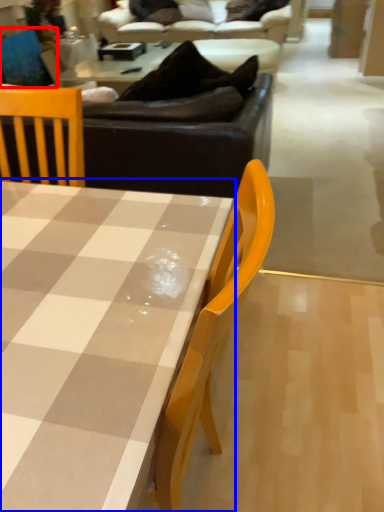
Question: Which of the following is the closest to the observer, swivel chair (highlighted by a red box) or coffee table (highlighted by a blue box)?

Choices:
 (A) swivel chair
 (B) coffee table

Answer: (B)